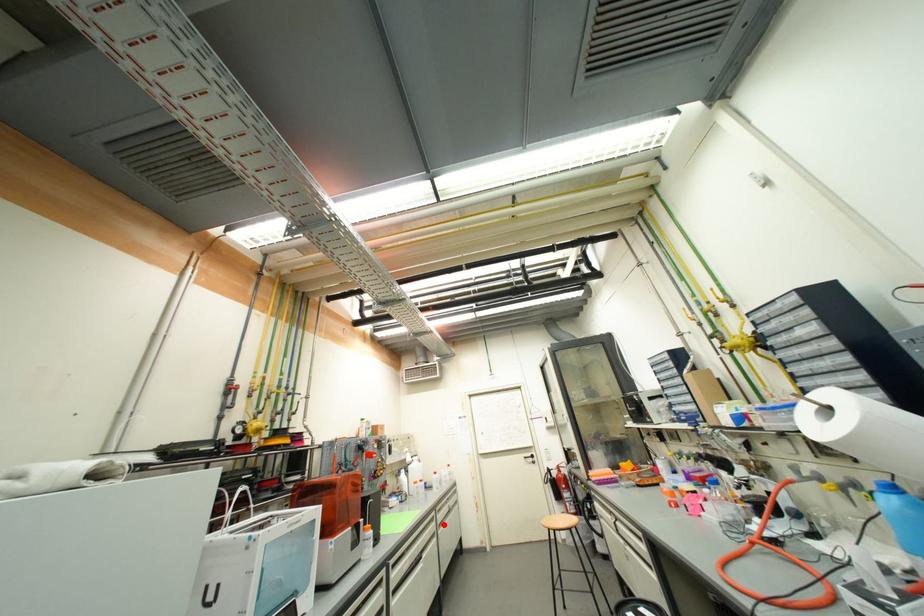
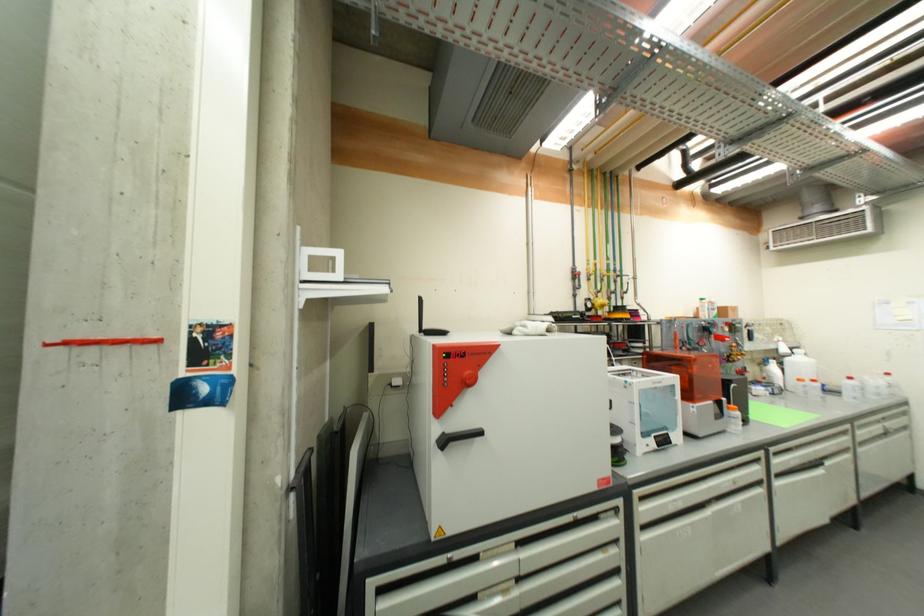
Question: I am providing you with two images of the same scene from different viewpoints. Given a red point in image1, look at the same physical point in image2. Is it:

Choices:
 (A) Closer to the viewpoint
 (B) Farther from the viewpoint

Answer: (A)